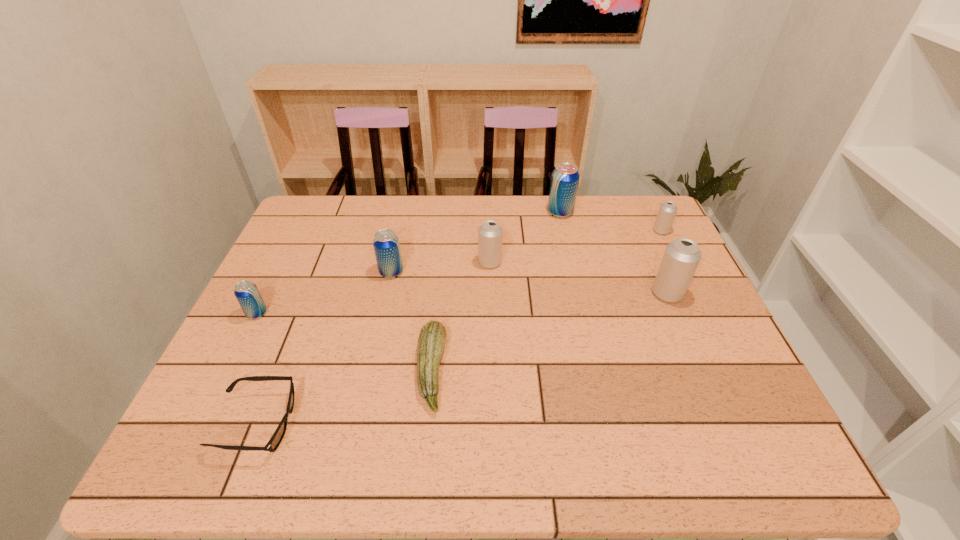
You are a GUI agent. You are given a task and a screenshot of the screen. Output one action in this format:
    pyautogui.click(x=<x>, y=<y>)
    Task: Click on the third beer can from right to left
    
    Given the screenshot: What is the action you would take?
    [565, 177]

This screenshot has height=540, width=960. I want to click on the farthest beer can, so pyautogui.click(x=565, y=177).

Locate an element on the screen. Image resolution: width=960 pixels, height=540 pixels. the fifth farthest object is located at coordinates [x=681, y=257].

The image size is (960, 540). What are the coordinates of `the biggest white beer can` in the screenshot? It's located at (681, 257).

You are a GUI agent. You are given a task and a screenshot of the screen. Output one action in this format:
    pyautogui.click(x=<x>, y=<y>)
    Task: Click on the fourth object from right to left
    Image resolution: width=960 pixels, height=540 pixels.
    Given the screenshot: What is the action you would take?
    pyautogui.click(x=490, y=233)

You are a GUI agent. You are given a task and a screenshot of the screen. Output one action in this format:
    pyautogui.click(x=<x>, y=<y>)
    Task: Click on the second farthest white beer can
    This screenshot has height=540, width=960.
    Given the screenshot: What is the action you would take?
    pyautogui.click(x=490, y=233)

At what (x,y) coordinates should I click in order to perform the action: click on the third object from left to right. Please return your answer as a coordinate pair (x, y). The image size is (960, 540). Looking at the image, I should click on (386, 245).

At what (x,y) coordinates should I click in order to perform the action: click on the second biggest blue beer can. Please return your answer as a coordinate pair (x, y). Looking at the image, I should click on (386, 245).

This screenshot has width=960, height=540. I want to click on the nearest blue beer can, so click(x=247, y=294).

Locate an element on the screen. The height and width of the screenshot is (540, 960). the nearest beer can is located at coordinates (247, 294).